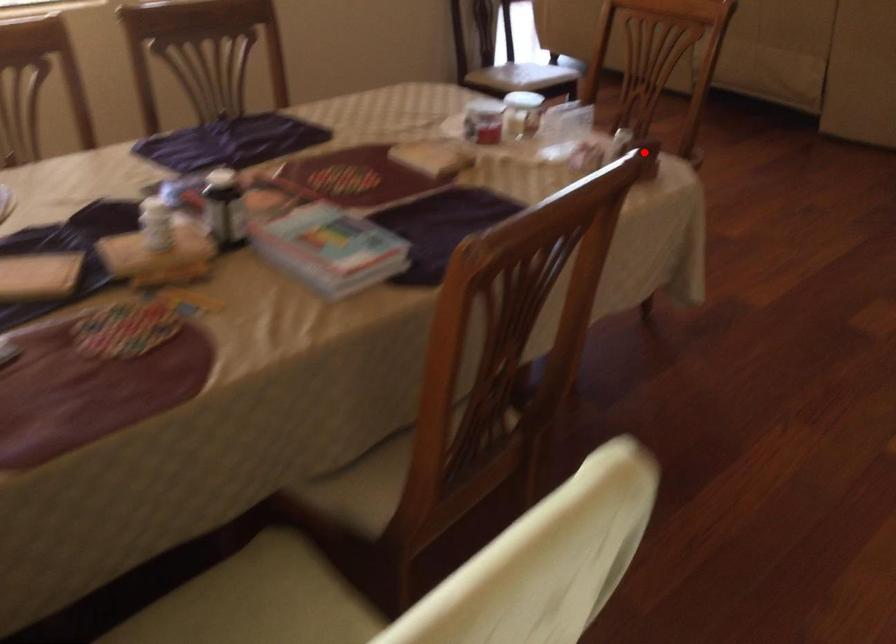
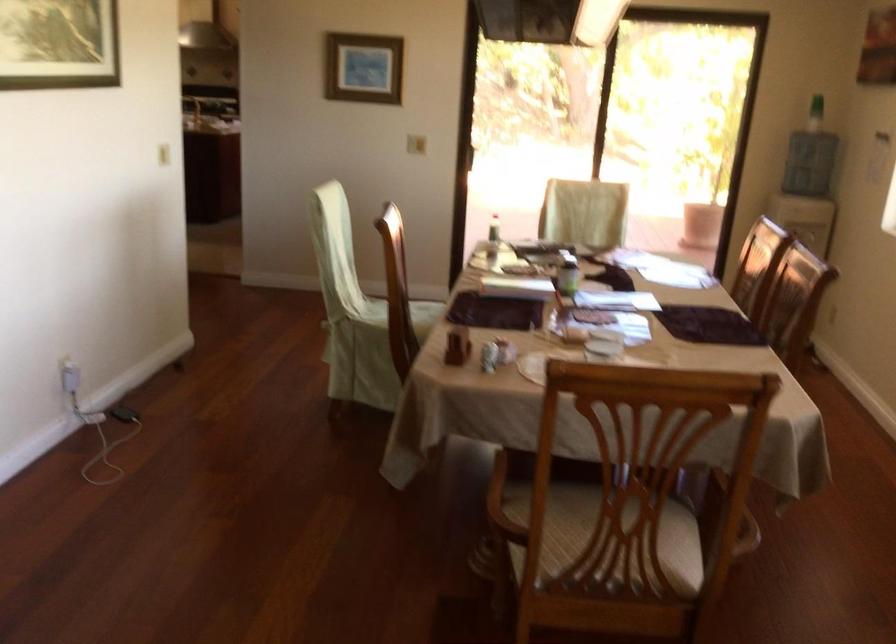
Question: I am providing you with two images of the same scene from different viewpoints. A red point is shown in image1. For the corresponding object point in image2, is it positioned nearer or farther from the camera?

Choices:
 (A) Nearer
 (B) Farther

Answer: (B)